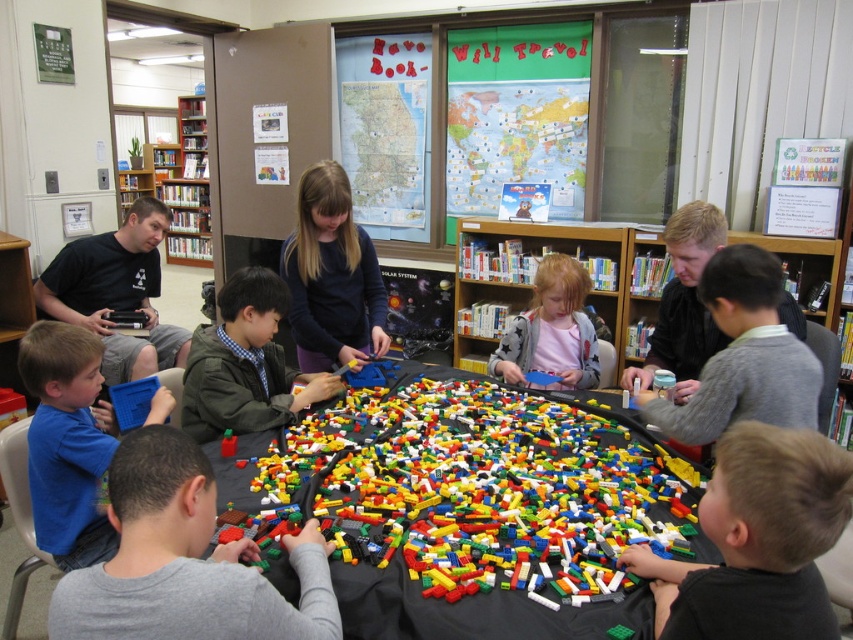
Does point (519, 289) come in front of point (764, 390)?

No, (519, 289) is further to viewer.

Between wooden bookshelf at center and matte gray sweater at right, which one appears on the left side from the viewer's perspective?

wooden bookshelf at center is more to the left.

Identify the location of wooden bookshelf at center. (540, 285).

Does blue matte tablet at lower left have a greater height compared to matte gray sweater at right?

Yes, blue matte tablet at lower left is taller than matte gray sweater at right.

Measure the distance between blue matte tablet at lower left and camera.

blue matte tablet at lower left and camera are 5.80 feet apart from each other.

Is point (73, 369) in front of point (665, 410)?

No, it is not.

The image size is (853, 640). I want to click on blue matte tablet at lower left, so click(x=67, y=442).

Consider the image. Can you confirm if gray matte shirt at lower left is wider than matte blue shirt at center?

Indeed, gray matte shirt at lower left has a greater width compared to matte blue shirt at center.

Is gray matte shirt at lower left to the right of matte blue shirt at center from the viewer's perspective?

In fact, gray matte shirt at lower left is to the left of matte blue shirt at center.

What do you see at coordinates (184, 561) in the screenshot? I see `gray matte shirt at lower left` at bounding box center [184, 561].

Where is `gray matte shirt at lower left`? Image resolution: width=853 pixels, height=640 pixels. gray matte shirt at lower left is located at coordinates (184, 561).